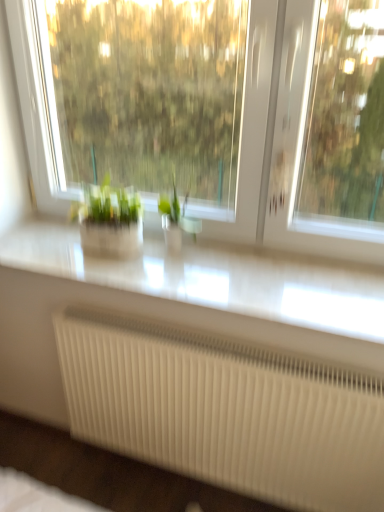
At what (x,y) coordinates should I click in order to perform the action: click on white glossy counter top at center. Please return your answer as a coordinate pair (x, y). The image size is (384, 512). Looking at the image, I should click on (212, 279).

At what (x,y) coordinates should I click in order to perform the action: click on transparent glass window at center. Please return your answer as a coordinate pair (x, y). Looking at the image, I should click on (213, 112).

This screenshot has width=384, height=512. Find the location of `white ribbed radiator at lower center`. white ribbed radiator at lower center is located at coordinates (225, 412).

Does transparent glass window at center have a smaller size compared to white ribbed radiator at lower center?

Incorrect, transparent glass window at center is not smaller in size than white ribbed radiator at lower center.

Based on their positions, is transparent glass window at center located to the left or right of white ribbed radiator at lower center?

From the image, it's evident that transparent glass window at center is to the left of white ribbed radiator at lower center.

Where is `window above the white ribbed radiator at lower center (from the image's perspective)`? window above the white ribbed radiator at lower center (from the image's perspective) is located at coordinates (213, 112).

Is point (220, 155) positioned after point (206, 391)?

Yes, point (220, 155) is farther from viewer.

Is white ribbed radiator at lower center thinner than green matte plant at center?

Incorrect, the width of white ribbed radiator at lower center is not less than that of green matte plant at center.

Could you tell me if white ribbed radiator at lower center is turned towards green matte plant at center?

No, white ribbed radiator at lower center is not oriented towards green matte plant at center.

From a real-world perspective, relative to green matte plant at center, is white ribbed radiator at lower center vertically above or below?

In terms of real-world spatial position, white ribbed radiator at lower center is below green matte plant at center.

How different are the orientations of white ribbed radiator at lower center and green matte plant at center in degrees?

The angular difference between white ribbed radiator at lower center and green matte plant at center is 1.06 degrees.

Is white ribbed radiator at lower center at the left side of transparent glass window at center?

In fact, white ribbed radiator at lower center is to the right of transparent glass window at center.

Choose the correct answer: Is white ribbed radiator at lower center inside transparent glass window at center or outside it?

white ribbed radiator at lower center exists outside the volume of transparent glass window at center.

From the image's perspective, which one is positioned lower, white ribbed radiator at lower center or transparent glass window at center?

From the image's view, white ribbed radiator at lower center is below.

Is point (84, 352) positioned in front of point (277, 155)?

No, it is behind (277, 155).

Is green matte plant at center bigger or smaller than white glossy counter top at center?

In the image, green matte plant at center appears to be smaller than white glossy counter top at center.

Is green matte plant at center positioned with its back to white glossy counter top at center?

No, green matte plant at center's orientation is not away from white glossy counter top at center.

Can you confirm if green matte plant at center is shorter than white glossy counter top at center?

In fact, green matte plant at center may be taller than white glossy counter top at center.

Can you confirm if white glossy counter top at center is bigger than green matte plant at center?

Yes.

How different are the orientations of white glossy counter top at center and green matte plant at center in degrees?

0.000292 degrees separate the facing orientations of white glossy counter top at center and green matte plant at center.

Does white glossy counter top at center appear on the right side of green matte plant at center?

In fact, white glossy counter top at center is to the left of green matte plant at center.

Between white glossy counter top at center and green matte plant at center, which one has larger width?

white glossy counter top at center.

Is transparent glass window at center facing away from white glossy counter top at center?

That's not correct — transparent glass window at center is not looking away from white glossy counter top at center.

Which is closer to the camera, (84, 82) or (70, 255)?

Point (84, 82) is positioned farther from the camera compared to point (70, 255).

Is transparent glass window at center surrounding white glossy counter top at center?

No, white glossy counter top at center is not surrounded by transparent glass window at center.

From the image's perspective, which is below, transparent glass window at center or white glossy counter top at center?

white glossy counter top at center.

Locate an element on the screen. The width and height of the screenshot is (384, 512). radiator that appears behind the white glossy counter top at center is located at coordinates point(225,412).

Does white glossy counter top at center have a greater width compared to white ribbed radiator at lower center?

Yes.

Consider the image. Between white glossy counter top at center and white ribbed radiator at lower center, which one is positioned in front?

white glossy counter top at center is closer to the camera.

Is white glossy counter top at center spatially inside white ribbed radiator at lower center, or outside of it?

white glossy counter top at center is spatially situated outside white ribbed radiator at lower center.

At what (x,y) coordinates should I click in order to perform the action: click on radiator that is under the transparent glass window at center (from a real-world perspective). Please return your answer as a coordinate pair (x, y). This screenshot has height=512, width=384. Looking at the image, I should click on (225, 412).

I want to click on houseplant that appears behind the white ribbed radiator at lower center, so click(x=176, y=218).

Which object lies nearer to the anchor point green matte plant at center, white glossy counter top at center or white ribbed radiator at lower center?

Among the two, white glossy counter top at center is located nearer to green matte plant at center.

Which object lies nearer to the anchor point white ribbed radiator at lower center, transparent glass window at center or white glossy counter top at center?

Based on the image, white glossy counter top at center appears to be nearer to white ribbed radiator at lower center.

Considering their positions, is transparent glass window at center positioned closer to green matte plant at center than white ribbed radiator at lower center?

Among the two, white ribbed radiator at lower center is located nearer to green matte plant at center.

Based on their spatial positions, is white glossy counter top at center or white ribbed radiator at lower center closer to transparent glass window at center?

Based on the image, white ribbed radiator at lower center appears to be nearer to transparent glass window at center.

Which object lies nearer to the anchor point white glossy counter top at center, green matte plant at center or white ribbed radiator at lower center?

green matte plant at center.

Consider the image. Based on their spatial positions, is white ribbed radiator at lower center or green matte plant at center closer to transparent glass window at center?

Among the two, white ribbed radiator at lower center is located nearer to transparent glass window at center.

Based on their spatial positions, is white glossy counter top at center or green matte plant at center closer to white ribbed radiator at lower center?

white glossy counter top at center is closer to white ribbed radiator at lower center.

Based on their spatial positions, is transparent glass window at center or white glossy counter top at center further from green matte plant at center?

transparent glass window at center lies further to green matte plant at center than the other object.

The image size is (384, 512). I want to click on counter top between green matte plant at center and white ribbed radiator at lower center from top to bottom, so click(212, 279).

Identify the location of houseplant between transparent glass window at center and white glossy counter top at center vertically. (176, 218).

I want to click on counter top between transparent glass window at center and white ribbed radiator at lower center from top to bottom, so click(x=212, y=279).

Where is `houseplant between transparent glass window at center and white ribbed radiator at lower center in the up-down direction`? houseplant between transparent glass window at center and white ribbed radiator at lower center in the up-down direction is located at coordinates (176, 218).